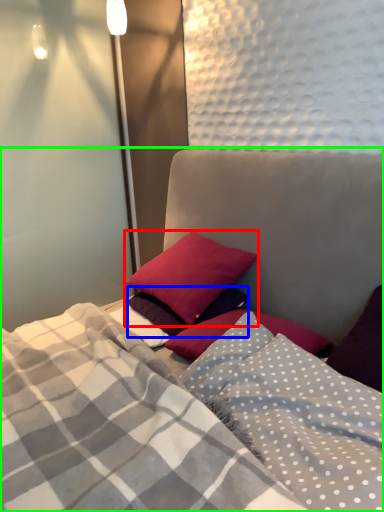
Question: Which object is the farthest from pillow (highlighted by a red box)? Choose among these: pillow (highlighted by a blue box) or bed (highlighted by a green box).

Choices:
 (A) pillow
 (B) bed

Answer: (B)